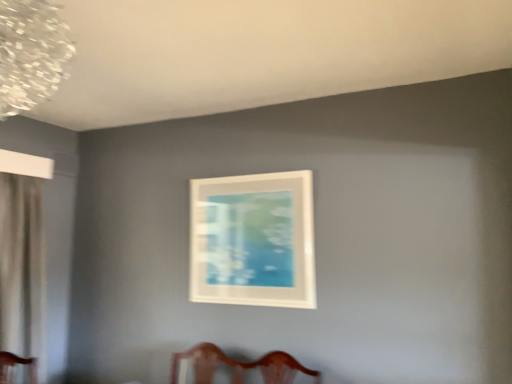
What is the approximate width of white matte picture frame at center?

3.96 centimeters.

What is the approximate width of clear crystal chandelier at upper left?

It is 46.15 centimeters.

This screenshot has width=512, height=384. What are the coordinates of `white sheer curtain at left` in the screenshot? It's located at (21, 265).

You are a GUI agent. You are given a task and a screenshot of the screen. Output one action in this format:
    pyautogui.click(x=<x>, y=<y>)
    Task: Click on the white matte picture frame at center
    This screenshot has height=384, width=512.
    Given the screenshot: What is the action you would take?
    pyautogui.click(x=253, y=240)

Looking at this image, from a real-world perspective, does clear crystal chandelier at upper left stand above white sheer curtain at left?

Yes, from a real-world perspective, clear crystal chandelier at upper left is over white sheer curtain at left

Does clear crystal chandelier at upper left turn towards white sheer curtain at left?

No, clear crystal chandelier at upper left is not turned towards white sheer curtain at left.

Considering the positions of points (40, 83) and (38, 181), is point (40, 83) farther from camera compared to point (38, 181)?

No, (40, 83) is closer to viewer.

From the image's perspective, relative to white sheer curtain at left, is clear crystal chandelier at upper left above or below?

clear crystal chandelier at upper left is above white sheer curtain at left.

Does clear crystal chandelier at upper left have a larger size compared to white matte picture frame at center?

Correct, clear crystal chandelier at upper left is larger in size than white matte picture frame at center.

From the picture: Considering their positions, is clear crystal chandelier at upper left located in front of or behind white matte picture frame at center?

clear crystal chandelier at upper left is positioned closer to the viewer than white matte picture frame at center.

Considering the positions of points (62, 34) and (287, 204), is point (62, 34) closer to camera compared to point (287, 204)?

Yes.

From the image's perspective, is clear crystal chandelier at upper left on white matte picture frame at center?

Yes, from the image's perspective, clear crystal chandelier at upper left is above white matte picture frame at center.

Between white sheer curtain at left and clear crystal chandelier at upper left, which one has smaller width?

white sheer curtain at left is thinner.

Which is more to the right, white sheer curtain at left or clear crystal chandelier at upper left?

From the viewer's perspective, clear crystal chandelier at upper left appears more on the right side.

Find the location of a particular element. This screenshot has height=384, width=512. lamp above the white sheer curtain at left (from a real-world perspective) is located at coordinates (31, 53).

Does white sheer curtain at left have a larger size compared to clear crystal chandelier at upper left?

Yes.

Between white sheer curtain at left and white matte picture frame at center, which one has more height?

white sheer curtain at left.

Does point (26, 191) appear closer or farther from the camera than point (209, 253)?

Point (26, 191) is farther from the camera than point (209, 253).

Is white sheer curtain at left with white matte picture frame at center?

They are not placed beside each other.

Is white sheer curtain at left inside the boundaries of white matte picture frame at center, or outside?

white sheer curtain at left is not enclosed by white matte picture frame at center.

Would you say white matte picture frame at center is a long distance from white sheer curtain at left?

white matte picture frame at center is positioned a significant distance from white sheer curtain at left.

Does white matte picture frame at center have a lesser height compared to white sheer curtain at left?

Indeed, white matte picture frame at center has a lesser height compared to white sheer curtain at left.

From the image's perspective, would you say white matte picture frame at center is positioned over white sheer curtain at left?

Indeed, from the image's perspective, white matte picture frame at center is shown above white sheer curtain at left.

Is white matte picture frame at center positioned with its back to white sheer curtain at left?

No, white matte picture frame at center is not facing the opposite direction of white sheer curtain at left.

Who is more distant, white matte picture frame at center or clear crystal chandelier at upper left?

Positioned behind is white matte picture frame at center.

Is white matte picture frame at center next to clear crystal chandelier at upper left?

white matte picture frame at center and clear crystal chandelier at upper left are clearly separated.

Between white matte picture frame at center and clear crystal chandelier at upper left, which one appears on the right side from the viewer's perspective?

white matte picture frame at center.

Identify the location of lamp above the white sheer curtain at left (from the image's perspective). Image resolution: width=512 pixels, height=384 pixels. (31, 53).

This screenshot has height=384, width=512. What are the coordinates of `lamp that appears on the left of white matte picture frame at center` in the screenshot? It's located at (31, 53).

Based on their spatial positions, is white matte picture frame at center or clear crystal chandelier at upper left closer to white sheer curtain at left?

Among the two, white matte picture frame at center is located nearer to white sheer curtain at left.

Estimate the real-world distances between objects in this image. Which object is further from white sheer curtain at left, clear crystal chandelier at upper left or white matte picture frame at center?

clear crystal chandelier at upper left is positioned further to the anchor white sheer curtain at left.

When comparing their distances from clear crystal chandelier at upper left, does white matte picture frame at center or white sheer curtain at left seem further?

white matte picture frame at center.

Which object lies further to the anchor point clear crystal chandelier at upper left, white sheer curtain at left or white matte picture frame at center?

white matte picture frame at center is further to clear crystal chandelier at upper left.

Estimate the real-world distances between objects in this image. Which object is further from white matte picture frame at center, clear crystal chandelier at upper left or white sheer curtain at left?

clear crystal chandelier at upper left.

Considering their positions, is white sheer curtain at left positioned further to white matte picture frame at center than clear crystal chandelier at upper left?

The object further to white matte picture frame at center is clear crystal chandelier at upper left.

The width and height of the screenshot is (512, 384). Find the location of `curtain located between clear crystal chandelier at upper left and white matte picture frame at center in the depth direction`. curtain located between clear crystal chandelier at upper left and white matte picture frame at center in the depth direction is located at coordinates (21, 265).